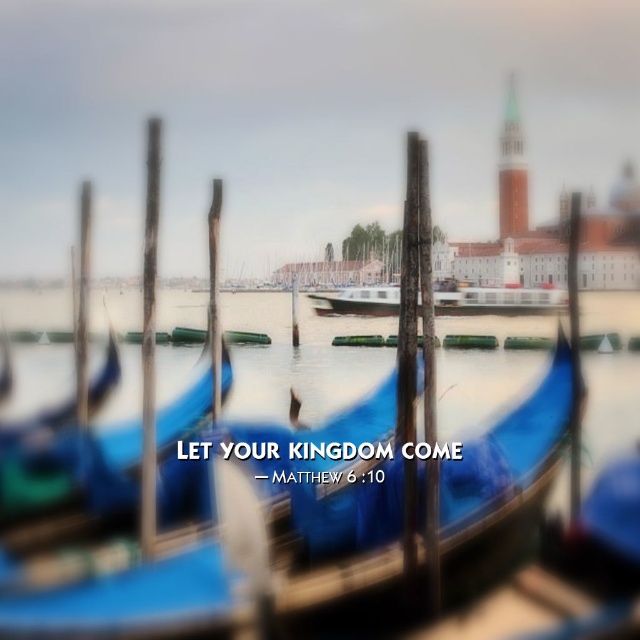
You are a tourist standing at the edge of the canal and want to take a photo of the blue polished wood gondola at center. Based on its position, where should you aim your camera to capture it in the frame?

You should aim your camera at the coordinates point (248, 513) to capture the blue polished wood gondola at center in the frame.

You are standing at the edge of a canal in Venice, Italy, and you see a blue polished wood gondola at center. If you want to take a photo of it, will you need to zoom in or zoom out to get the gondola to fill the frame?

The blue polished wood gondola at center is 183.93 feet from camera, so you will need to zoom in to get it to fill the frame.